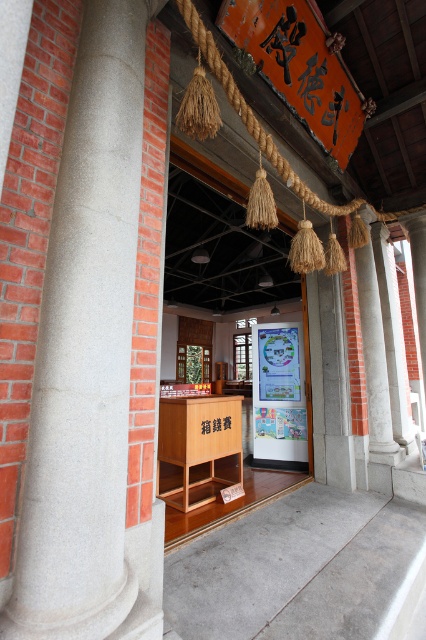
Between point (78, 120) and point (290, 376), which one is positioned behind?

The point (290, 376) is behind.

You are a GUI agent. You are given a task and a screenshot of the screen. Output one action in this format:
    pyautogui.click(x=<x>, y=<y>)
    Task: Click on the granite column at left
    
    Given the screenshot: What is the action you would take?
    pyautogui.click(x=86, y=356)

Locate an element on the screen. The height and width of the screenshot is (640, 426). granite column at left is located at coordinates (86, 356).

Between matte plastic bulletin board at center and white marble column at center, which one is positioned lower?

matte plastic bulletin board at center is lower down.

Does matte plastic bulletin board at center have a lesser height compared to white marble column at center?

Indeed, matte plastic bulletin board at center has a lesser height compared to white marble column at center.

Does point (299, 378) come behind point (379, 310)?

Yes, it is behind point (379, 310).

The height and width of the screenshot is (640, 426). What are the coordinates of `matte plastic bulletin board at center` in the screenshot? It's located at (279, 392).

Between wooden box at center and white marble column at center, which one appears on the right side from the viewer's perspective?

From the viewer's perspective, white marble column at center appears more on the right side.

Between point (199, 483) and point (377, 321), which one is positioned in front?

Point (199, 483) is more forward.

Find the location of a particular element. The height and width of the screenshot is (640, 426). wooden box at center is located at coordinates (196, 445).